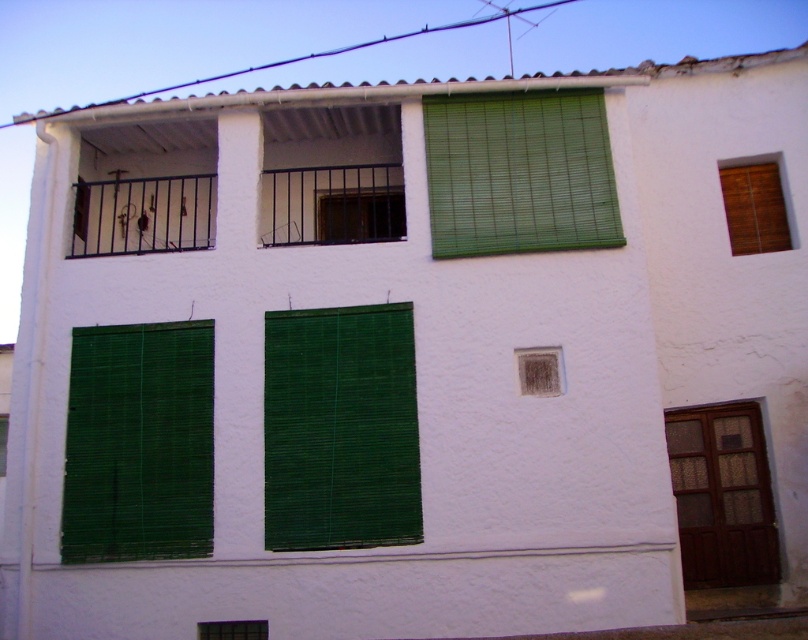
You are an interior designer assessing the lighting in a Mediterranean style room. You see a green bamboo curtain at center and a green bamboo blinds at lower left. Which object allows more natural light into the room?

The green bamboo blinds at lower left allows more natural light into the room since they are shorter than the green bamboo curtain at center.

You are standing 10 meters away from a building and want to take a photo of the green bamboo curtain at center. Is the curtain within the camera focus range of 10 meters?

The green bamboo curtain at center is 9.35 meters away from the camera, which is within the 10 meters focus range, so the curtain can be captured clearly.